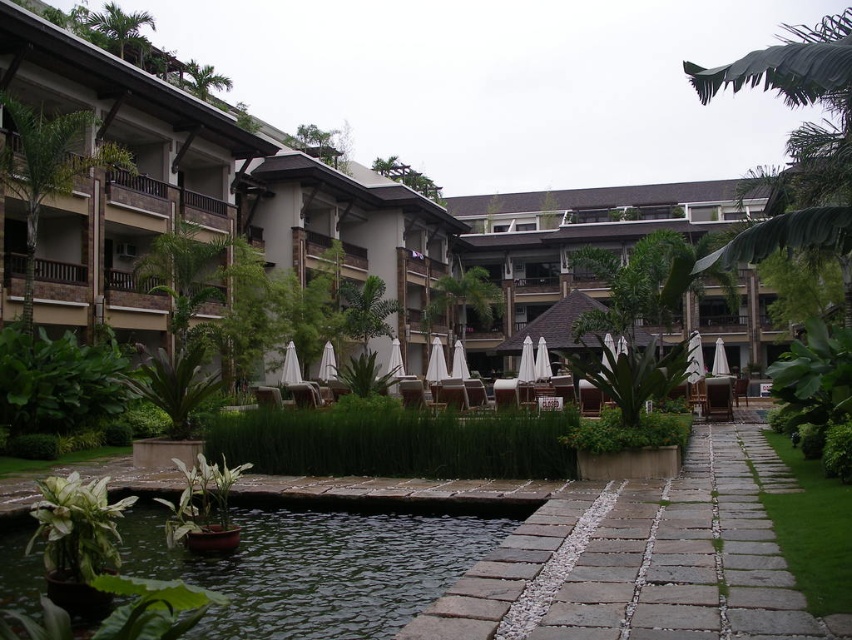
Which is in front, point (538, 534) or point (269, 531)?

Point (538, 534) is more forward.

Does gray stone path at center appear on the left side of green concrete pool at lower center?

In fact, gray stone path at center is to the right of green concrete pool at lower center.

The width and height of the screenshot is (852, 640). Find the location of `gray stone path at center`. gray stone path at center is located at coordinates (643, 560).

What are the coordinates of `gray stone path at center` in the screenshot? It's located at (643, 560).

Who is positioned more to the left, green concrete pool at lower center or white fabric umbrella at center?

white fabric umbrella at center is more to the left.

I want to click on green concrete pool at lower center, so click(324, 561).

This screenshot has width=852, height=640. Describe the element at coordinates (476, 76) in the screenshot. I see `brown textured resort at center` at that location.

Does point (498, 102) come in front of point (327, 342)?

No, (498, 102) is further to viewer.

Measure the distance between point (658,116) and camera.

The distance of point (658,116) from camera is 835.23 feet.

At what (x,y) coordinates should I click in order to perform the action: click on brown textured resort at center. Please return your answer as a coordinate pair (x, y). Looking at the image, I should click on (476, 76).